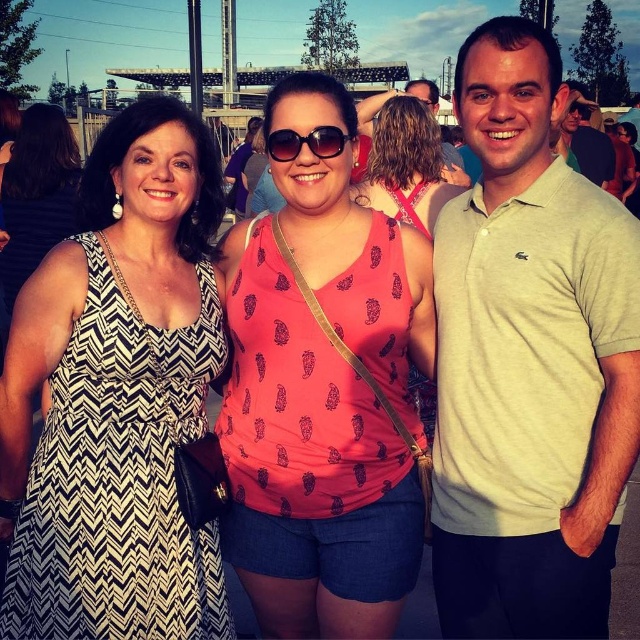
Who is more forward, (140,488) or (584,154)?

Point (140,488) is in front.

Between black zigzag dress at center and green cotton polo shirt at right, which one appears on the left side from the viewer's perspective?

black zigzag dress at center is more to the left.

Is point (12, 387) less distant than point (573, 154)?

Yes, it is in front of point (573, 154).

Image resolution: width=640 pixels, height=640 pixels. I want to click on black zigzag dress at center, so click(116, 396).

Is point (467, 244) behind point (582, 145)?

That is False.

Between light green polo shirt at right and green cotton polo shirt at right, which one appears on the left side from the viewer's perspective?

light green polo shirt at right is more to the left.

What do you see at coordinates (529, 362) in the screenshot? I see `light green polo shirt at right` at bounding box center [529, 362].

This screenshot has width=640, height=640. I want to click on light green polo shirt at right, so click(529, 362).

Can you confirm if black zigzag dress at center is positioned to the left of pineapple-patterned tank top at center?

Correct, you'll find black zigzag dress at center to the left of pineapple-patterned tank top at center.

Is the position of black zigzag dress at center more distant than that of pineapple-patterned tank top at center?

No.

Which is in front, point (177, 321) or point (291, 586)?

Point (177, 321) is in front.

Locate an element on the screen. This screenshot has width=640, height=640. black zigzag dress at center is located at coordinates (116, 396).